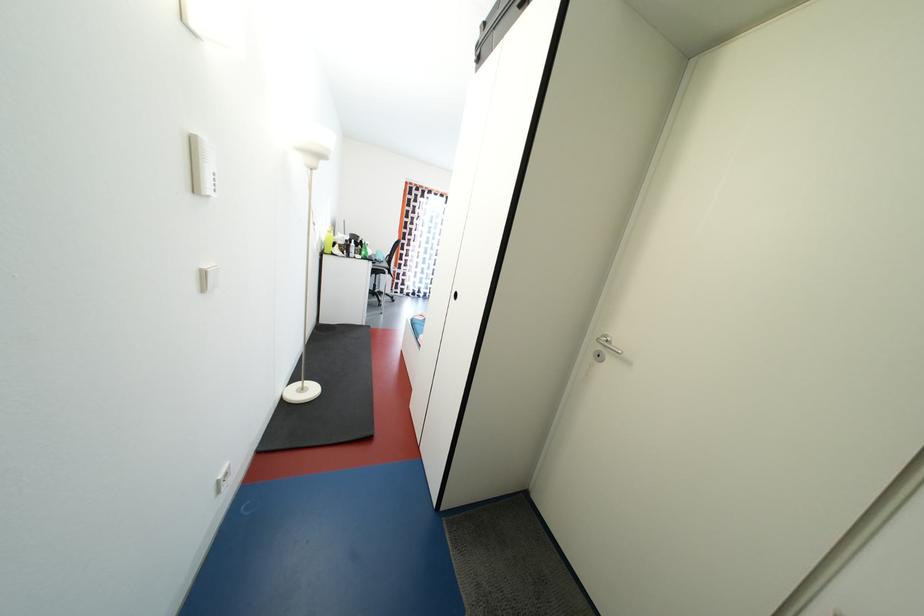
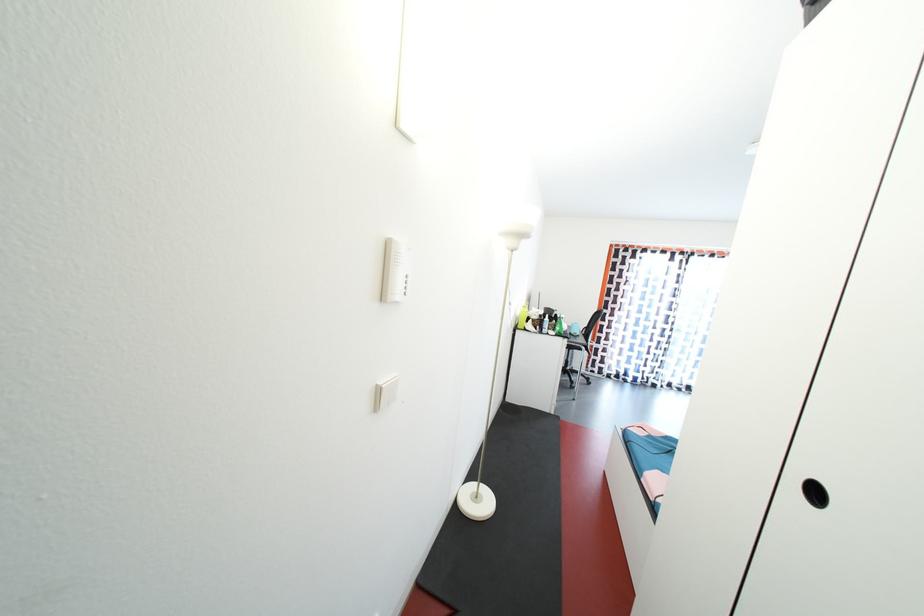
Where in the second image is the point corresponding to the point at 211,278 from the first image?

(384, 395)